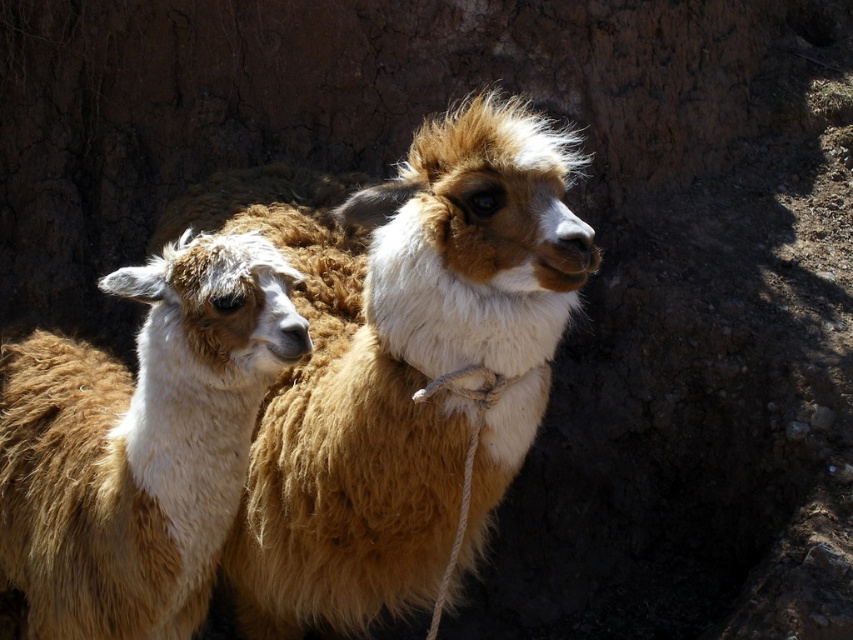
You are a farmer checking on your alpacas in the barn. You notice the fuzzy brown alpaca at center and the brown woolen alpaca at left. Which alpaca is closer to the entrance of the barn?

The fuzzy brown alpaca at center is closer to the entrance of the barn because the brown woolen alpaca at left is behind it.

You are a farmer who needs to identify the taller alpaca between the fuzzy brown alpaca at center and the brown woolen alpaca at left. Based on the scene, which one is taller?

The fuzzy brown alpaca at center is taller than the brown woolen alpaca at left.

Looking at this image, you are standing in front of the two alpacas and want to locate the point at coordinates (397, 360). Which alpaca is this point on?

The point at coordinates (397, 360) is on the fuzzy brown alpaca at center.